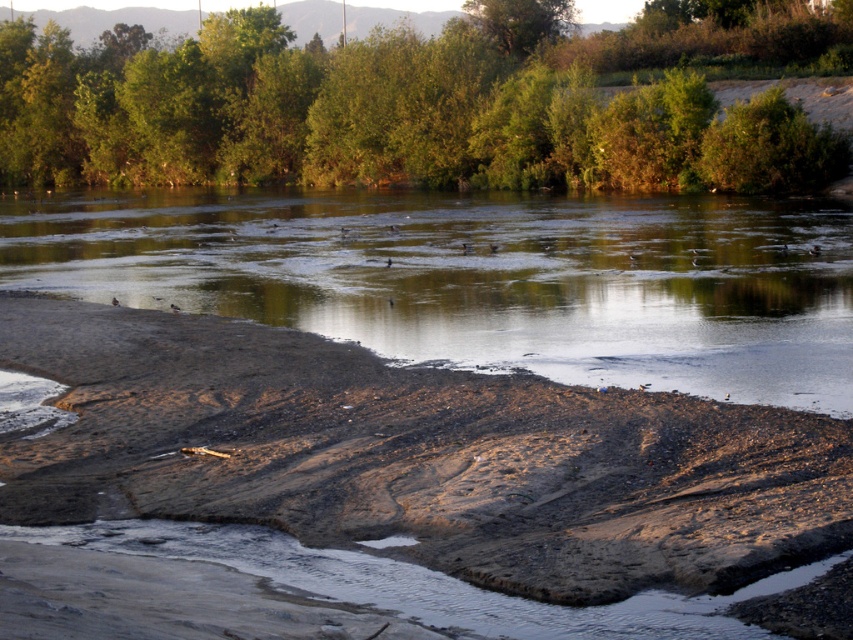
Question: Is the position of brown sandy beach at lower left less distant than that of brown dirt at lower center?

Choices:
 (A) yes
 (B) no

Answer: (A)

Question: Does brown sandy beach at lower left lie in front of green leafy trees at upper center?

Choices:
 (A) no
 (B) yes

Answer: (B)

Question: From the image, what is the correct spatial relationship of brown sandy beach at lower left in relation to brown dirt at lower center?

Choices:
 (A) below
 (B) above

Answer: (A)

Question: Which object is positioned farthest from the brown dirt at lower center?

Choices:
 (A) green leafy trees at upper center
 (B) brown sandy beach at lower left

Answer: (A)

Question: Which of the following is the closest to the observer?

Choices:
 (A) (221, 410)
 (B) (843, 253)
 (C) (657, 60)

Answer: (A)

Question: Estimate the real-world distances between objects in this image. Which object is farther from the green leafy trees at upper center?

Choices:
 (A) brown sandy beach at lower left
 (B) brown dirt at lower center

Answer: (A)